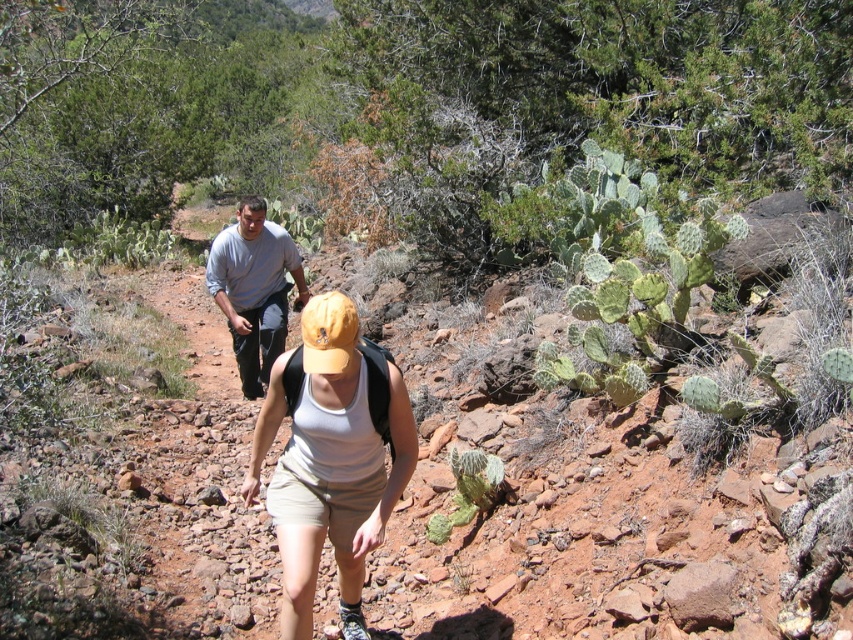
You are a hiker trying to catch up with your friend who is wearing gray fabric pants at center. You are currently standing next to the gray cotton shirt at upper left. In which direction should you move to reach your friend?

You should move to the left to reach your friend wearing gray fabric pants at center because the gray cotton shirt at upper left is positioned to the right of gray fabric pants at center.

In the scene shown: You are a hiker planning to join the group in the image. You notice two gray clothing items ahead on the trail. Which clothing item is closer to you, the gray cotton shirt at upper left or the gray fabric pants at center?

The gray cotton shirt at upper left is located below the gray fabric pants at center, meaning it is closer to you since it appears lower in the image.

You are a hiker who wants to catch up with the person wearing the gray cotton shirt at upper left. If you walk at a speed of 3 feet per second, how many seconds will it take you to reach them?

The distance between you and the gray cotton shirt at upper left is 9.15 feet. At a speed of 3 feet per second, it will take 3.05 seconds to reach them.